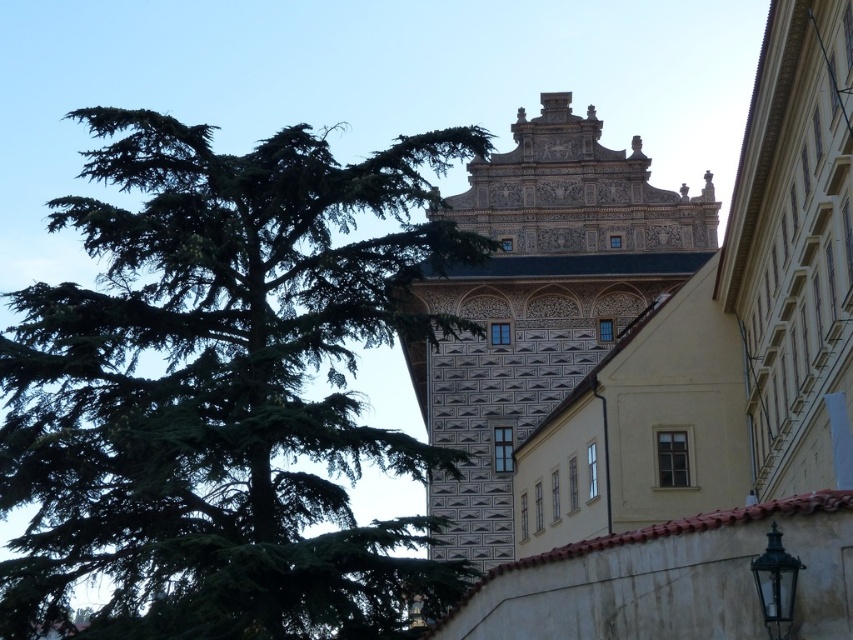
Image resolution: width=853 pixels, height=640 pixels. What do you see at coordinates (222, 388) in the screenshot? I see `green needle-like tree at left` at bounding box center [222, 388].

Is green needle-like tree at left positioned behind dark brown stone tower at center?

That is False.

Who is more distant from viewer, [100,564] or [550,380]?

Positioned behind is point [550,380].

This screenshot has width=853, height=640. Identify the location of green needle-like tree at left. (222, 388).